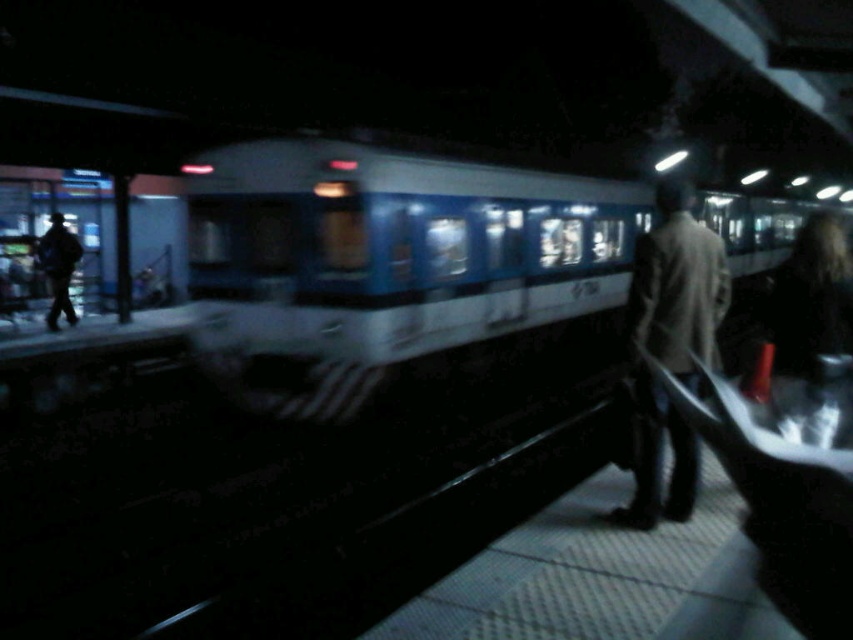
Question: Is light brown leather jacket at center positioned in front of dark gray coat at left?

Choices:
 (A) yes
 (B) no

Answer: (A)

Question: Does blue/white metal train at center appear on the right side of light brown leather jacket at center?

Choices:
 (A) no
 (B) yes

Answer: (B)

Question: Which point is closer to the camera taking this photo?

Choices:
 (A) (404, 188)
 (B) (712, 300)

Answer: (B)

Question: Is light brown leather jacket at center bigger than dark gray coat at left?

Choices:
 (A) yes
 (B) no

Answer: (B)

Question: Which object appears closest to the camera in this image?

Choices:
 (A) dark gray coat at left
 (B) blue/white metal train at center
 (C) light brown leather jacket at center

Answer: (C)

Question: Among these points, which one is nearest to the camera?

Choices:
 (A) (480, 282)
 (B) (44, 264)

Answer: (A)